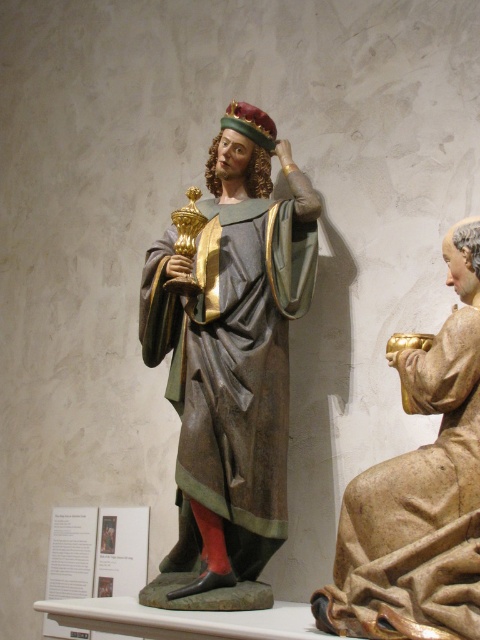
Between polychrome wood statue at center and wooden cup at right, which one has less height?

Standing shorter between the two is wooden cup at right.

This screenshot has height=640, width=480. In order to click on polychrome wood statue at center in this screenshot , I will do `click(232, 349)`.